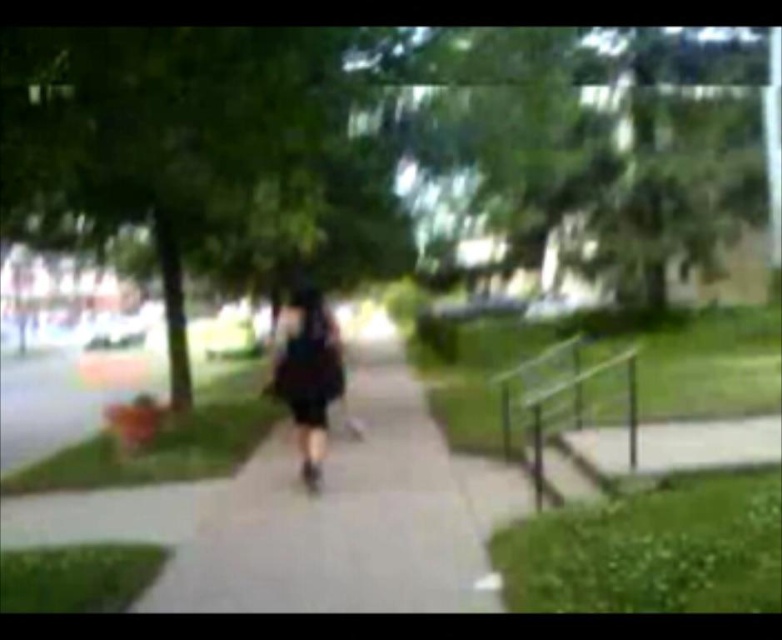
You are a photographer trying to capture a clear shot of the black matte dress at center while avoiding the gray concrete sidewalk at center. Since the image is slightly blurred, which object should you focus on to ensure the dress is sharp, considering their sizes?

The gray concrete sidewalk at center has a larger size compared to black matte dress at center. To ensure the black matte dress at center is sharp, focus on the smaller object, which is the dress.